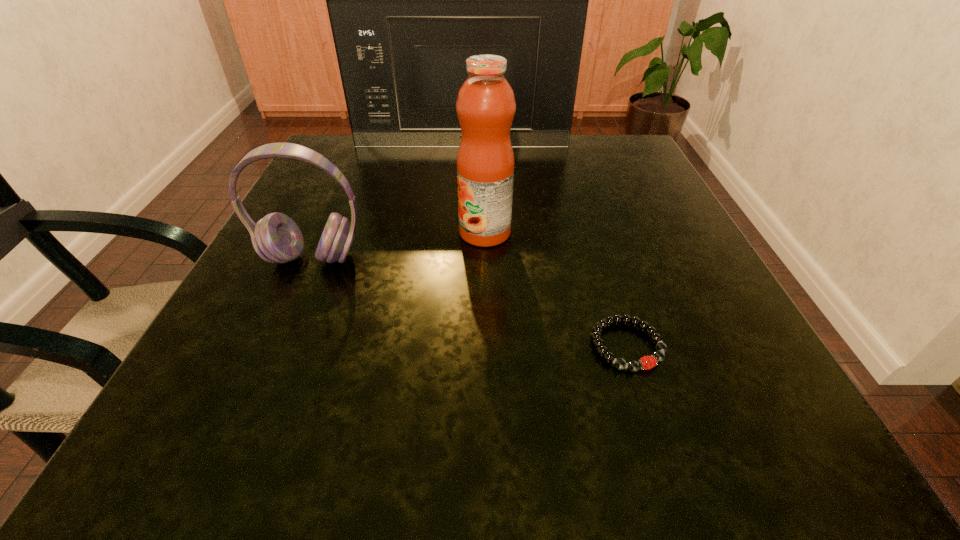
Locate an element on the screen. The width and height of the screenshot is (960, 540). free space at the far left corner of the desktop is located at coordinates (298, 185).

In the image, there is a desktop. Where is `vacant region at the near right corner`? vacant region at the near right corner is located at coordinates (700, 402).

Where is `free space that is in between the fruit juice and the shortest object`? free space that is in between the fruit juice and the shortest object is located at coordinates (556, 289).

Find the location of a particular element. The height and width of the screenshot is (540, 960). vacant point located between the shortest object and the fruit juice is located at coordinates (556, 289).

In order to click on vacant space that's between the microwave oven and the headset in this screenshot , I will do `click(387, 202)`.

Locate an element on the screen. free space between the headset and the fruit juice is located at coordinates (398, 246).

The width and height of the screenshot is (960, 540). I want to click on blank region between the third tallest object and the fruit juice, so click(398, 246).

The width and height of the screenshot is (960, 540). I want to click on unoccupied position between the microwave oven and the shortest object, so click(544, 246).

Where is `object identified as the closest to the shortest object`? The image size is (960, 540). object identified as the closest to the shortest object is located at coordinates (485, 106).

Point out which object is positioned as the second nearest to the bracelet. Please provide its 2D coordinates. Your answer should be formatted as a tuple, i.e. [(x, y)], where the tuple contains the x and y coordinates of a point satisfying the conditions above.

[(276, 238)]